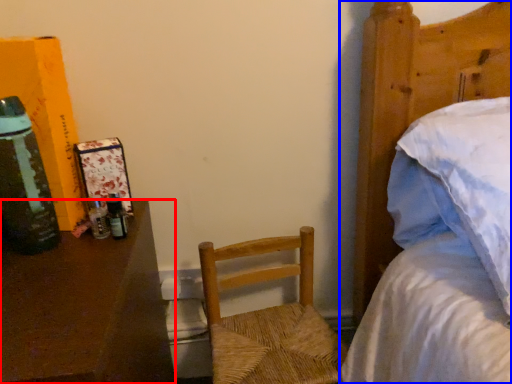
Question: Which object is closer to the camera taking this photo, desk (highlighted by a red box) or bed (highlighted by a blue box)?

Choices:
 (A) desk
 (B) bed

Answer: (B)